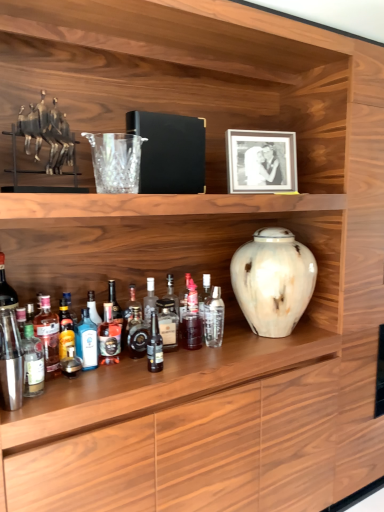
Question: In which direction should I rotate to look at blue glass bottle at center, which is counted as the seventh bottle, starting from the right?

Choices:
 (A) right
 (B) left

Answer: (B)

Question: Does translucent glass bottle at center, which appears as the 9th bottle when viewed from the left, have a greater height compared to white marble vase at center?

Choices:
 (A) no
 (B) yes

Answer: (A)

Question: Is translucent glass bottle at center, the 2th bottle positioned from the right, not near white marble vase at center?

Choices:
 (A) no
 (B) yes

Answer: (A)

Question: From a real-world perspective, is translucent glass bottle at center, which appears as the 9th bottle when viewed from the left, below white marble vase at center?

Choices:
 (A) yes
 (B) no

Answer: (A)

Question: Is translucent glass bottle at center, the 2th bottle positioned from the right, wider than white marble vase at center?

Choices:
 (A) no
 (B) yes

Answer: (A)

Question: Is the depth of translucent glass bottle at center, the 2th bottle positioned from the right, greater than that of white marble vase at center?

Choices:
 (A) yes
 (B) no

Answer: (A)

Question: Is translucent glass bottle at center, the 2th bottle positioned from the right, bigger than white marble vase at center?

Choices:
 (A) no
 (B) yes

Answer: (A)

Question: Does shiny metallic shaker at left, which appears as the 1th bottle when viewed from the left, have a greater height compared to shiny dark brown bottle at center, which is counted as the fifth bottle, starting from the right?

Choices:
 (A) yes
 (B) no

Answer: (A)

Question: Does shiny metallic shaker at left, positioned as the 10th bottle in right-to-left order, lie behind shiny dark brown bottle at center, which is counted as the fifth bottle, starting from the right?

Choices:
 (A) yes
 (B) no

Answer: (B)

Question: Is shiny dark brown bottle at center, the 6th bottle viewed from the left, a part of shiny metallic shaker at left, which appears as the 1th bottle when viewed from the left?

Choices:
 (A) no
 (B) yes

Answer: (A)

Question: Considering the relative sizes of shiny metallic shaker at left, positioned as the 10th bottle in right-to-left order, and shiny dark brown bottle at center, which is counted as the fifth bottle, starting from the right, in the image provided, is shiny metallic shaker at left, positioned as the 10th bottle in right-to-left order, smaller than shiny dark brown bottle at center, which is counted as the fifth bottle, starting from the right,?

Choices:
 (A) yes
 (B) no

Answer: (B)

Question: From the image's perspective, is shiny metallic shaker at left, which appears as the 1th bottle when viewed from the left, below shiny dark brown bottle at center, the 6th bottle viewed from the left?

Choices:
 (A) no
 (B) yes

Answer: (B)

Question: Considering the relative sizes of shiny metallic shaker at left, positioned as the 10th bottle in right-to-left order, and shiny dark brown bottle at center, which is counted as the fifth bottle, starting from the right, in the image provided, is shiny metallic shaker at left, positioned as the 10th bottle in right-to-left order, bigger than shiny dark brown bottle at center, which is counted as the fifth bottle, starting from the right,?

Choices:
 (A) no
 (B) yes

Answer: (B)

Question: Does translucent glass bottle at lower left, which ranks as the third bottle in left-to-right order, have a lesser width compared to translucent glass bottle at lower left, marked as the second bottle in a left-to-right arrangement?

Choices:
 (A) no
 (B) yes

Answer: (A)